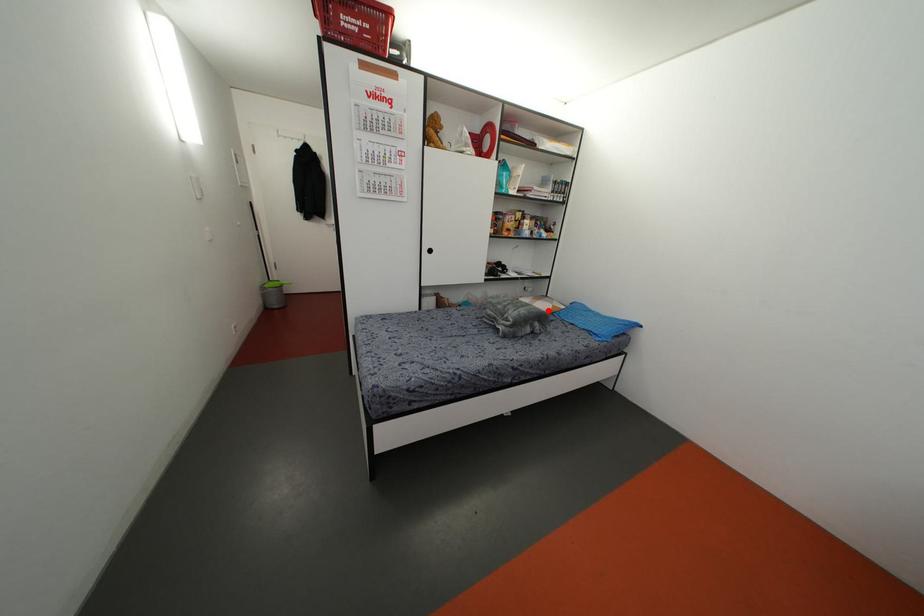
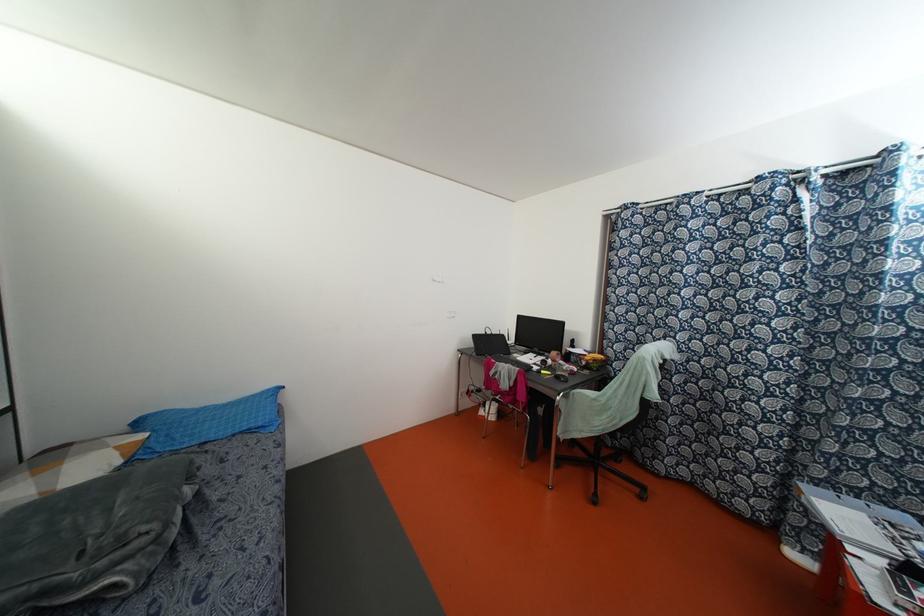
Question: I am providing you with two images of the same scene from different viewpoints. Given a red point in image1, look at the same physical point in image2. Is it:

Choices:
 (A) Closer to the viewpoint
 (B) Farther from the viewpoint

Answer: (A)